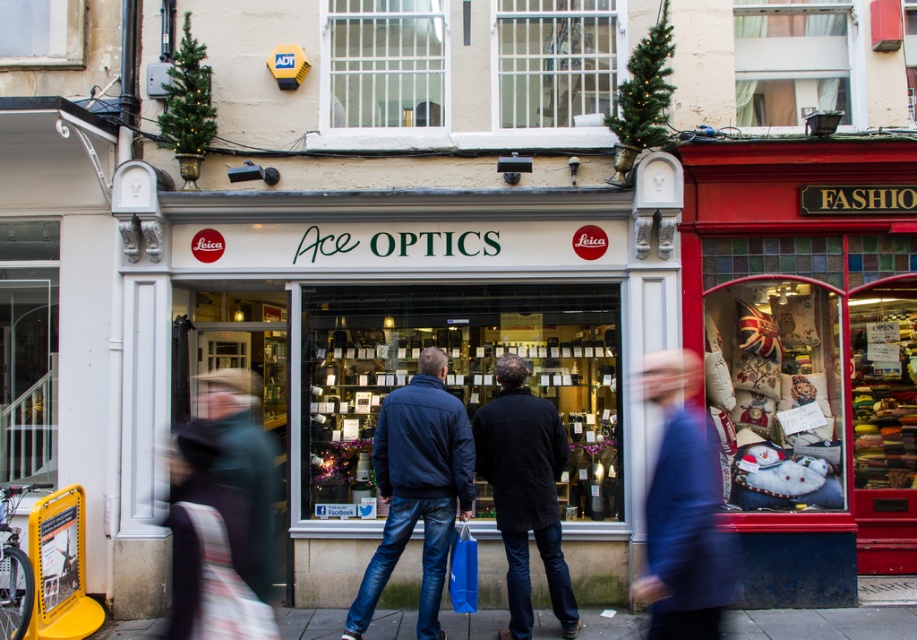
Who is positioned more to the left, blue denim jeans at center or blue woolen coat at center?

blue denim jeans at center is more to the left.

The image size is (917, 640). What do you see at coordinates (417, 486) in the screenshot?
I see `blue denim jeans at center` at bounding box center [417, 486].

Between point (418, 429) and point (716, 534), which one is positioned behind?

The point (418, 429) is more distant.

You are a GUI agent. You are given a task and a screenshot of the screen. Output one action in this format:
    pyautogui.click(x=<x>, y=<y>)
    Task: Click on the blue denim jeans at center
    The height and width of the screenshot is (640, 917).
    Given the screenshot: What is the action you would take?
    point(417,486)

Who is lower down, black matte coat at center or smooth concrete sidewalk at center?

smooth concrete sidewalk at center is lower down.

Does black matte coat at center lie in front of smooth concrete sidewalk at center?

Yes, it is in front of smooth concrete sidewalk at center.

Which is behind, point (551, 554) or point (816, 637)?

Positioned behind is point (816, 637).

Find the location of a particular element. black matte coat at center is located at coordinates (525, 492).

Does blue woolen coat at center have a greater height compared to smooth concrete sidewalk at center?

Yes.

Is point (652, 388) positioned after point (835, 620)?

No, it is not.

Is point (645, 372) closer to viewer compared to point (874, 624)?

That is True.

This screenshot has height=640, width=917. Find the location of `blue woolen coat at center`. blue woolen coat at center is located at coordinates (682, 513).